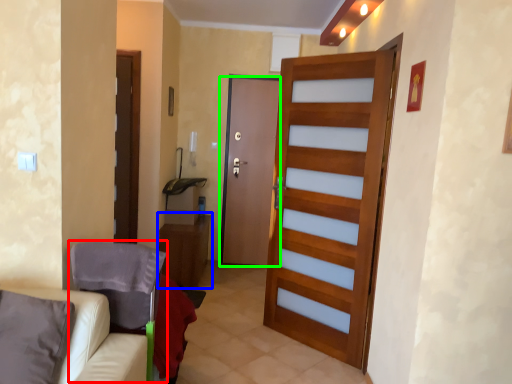
Question: Which is nearer to the armchair (highlighted by a red box)? table (highlighted by a blue box) or door (highlighted by a green box).

Choices:
 (A) table
 (B) door

Answer: (A)